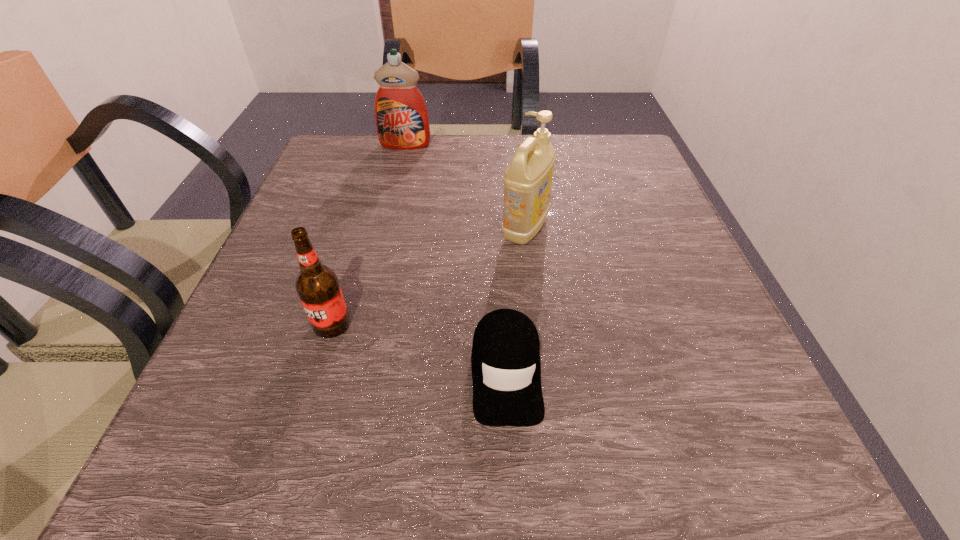
Where is `object at the near edge`? This screenshot has width=960, height=540. object at the near edge is located at coordinates (506, 371).

Locate an element on the screen. detergent situated at the left edge is located at coordinates (401, 116).

At what (x,y) coordinates should I click in order to perform the action: click on root beer that is positioned at the left edge. Please return your answer as a coordinate pair (x, y). This screenshot has width=960, height=540. Looking at the image, I should click on (317, 285).

Image resolution: width=960 pixels, height=540 pixels. I want to click on object that is at the far left corner, so click(401, 116).

Image resolution: width=960 pixels, height=540 pixels. In the image, there is a desktop. Find the location of `vacant space at the far edge`. vacant space at the far edge is located at coordinates (446, 179).

At what (x,y) coordinates should I click in order to perform the action: click on free region at the near edge. Please return your answer as a coordinate pair (x, y). This screenshot has height=540, width=960. Looking at the image, I should click on (492, 434).

In the image, there is a desktop. Find the location of `vacant region at the left edge`. vacant region at the left edge is located at coordinates (278, 292).

The height and width of the screenshot is (540, 960). What are the coordinates of `free space at the right edge of the desktop` in the screenshot? It's located at (725, 392).

This screenshot has width=960, height=540. I want to click on vacant space at the far left corner, so click(x=374, y=187).

Locate an element on the screen. The width and height of the screenshot is (960, 540). vacant space at the far right corner of the desktop is located at coordinates (573, 140).